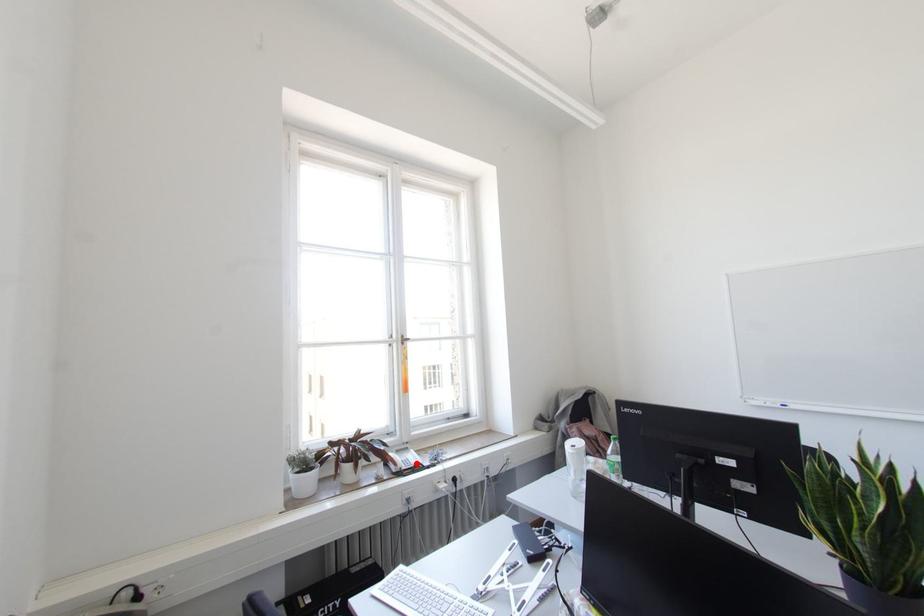
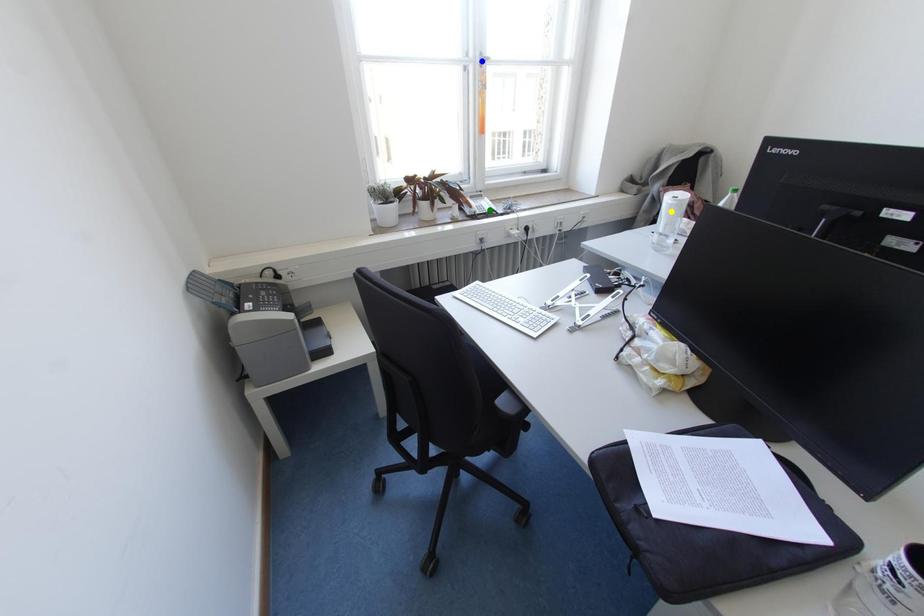
Question: I am providing you with two images of the same scene from different viewpoints. A red point is marked on the first image. You are given multiple points on the second image. Which spot in image 2 lines up with the point in image 1?

Choices:
 (A) blue point
 (B) green point
 (C) yellow point

Answer: (B)